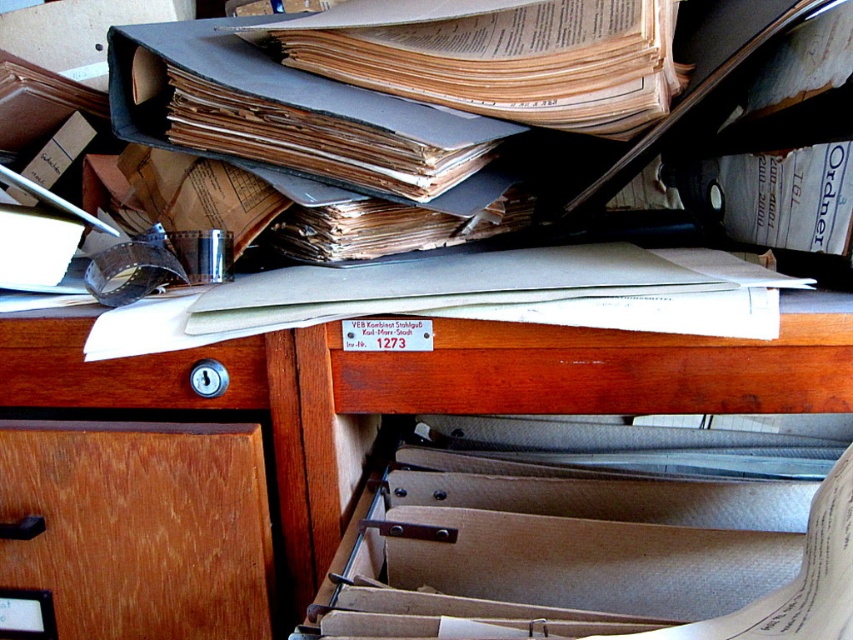
Question: Estimate the real-world distances between objects in this image. Which object is farther from the wooden desk at center?

Choices:
 (A) wooden drawer at lower left
 (B) wooden drawer at left

Answer: (A)

Question: Where is wooden desk at center located in relation to wooden drawer at lower left in the image?

Choices:
 (A) above
 (B) below

Answer: (A)

Question: Which is nearer to the wooden drawer at left?

Choices:
 (A) wooden drawer at lower left
 (B) wooden desk at center

Answer: (B)

Question: Which object is positioned closest to the wooden drawer at lower left?

Choices:
 (A) wooden desk at center
 (B) wooden drawer at left

Answer: (A)

Question: Does wooden desk at center appear over wooden drawer at left?

Choices:
 (A) no
 (B) yes

Answer: (A)

Question: From the image, what is the correct spatial relationship of wooden desk at center in relation to wooden drawer at left?

Choices:
 (A) above
 (B) below

Answer: (B)